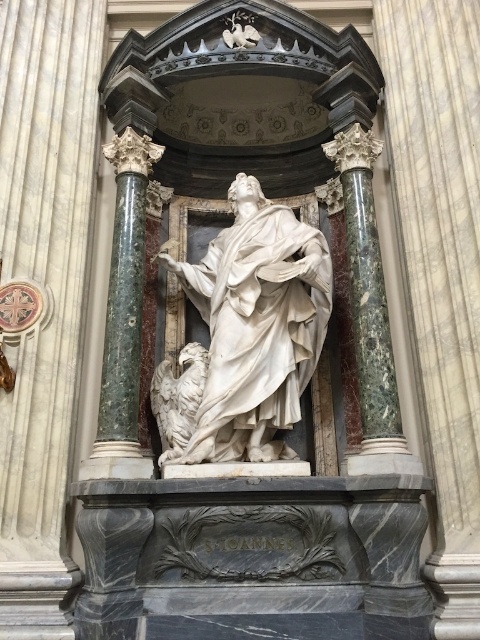
You are an art conservator tasked with moving the white marble eagle at lower left closer to the green marble column at left for a restoration project. The minimum safe distance required between the two objects for preservation purposes is 4 feet. Can you safely move the eagle to within the required distance without violating preservation guidelines?

The current distance between the green marble column at left and the white marble eagle at lower left is 5.26 feet. Since the minimum safe distance required is 4 feet, moving the eagle closer to within 4 feet would still comply with preservation guidelines as it would not be less than the required distance.

You are an art student standing in front of the statue and want to sketch both the white marble statue at center and the white marble eagle at lower left. Which object should you focus on first if you want to draw the one closer to you?

The white marble statue at center is closer to you than the white marble eagle at lower left, so you should focus on drawing the white marble statue at center first.